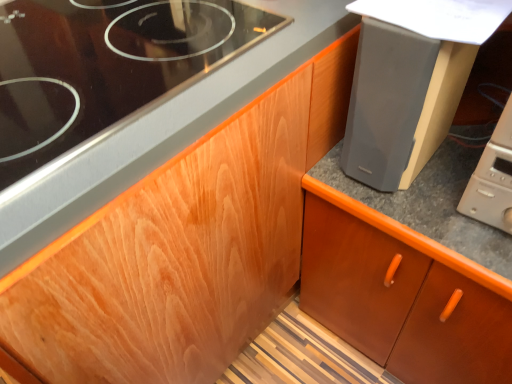
Identify the location of free location to the left of beige plastic microwave at lower right. pyautogui.click(x=428, y=206).